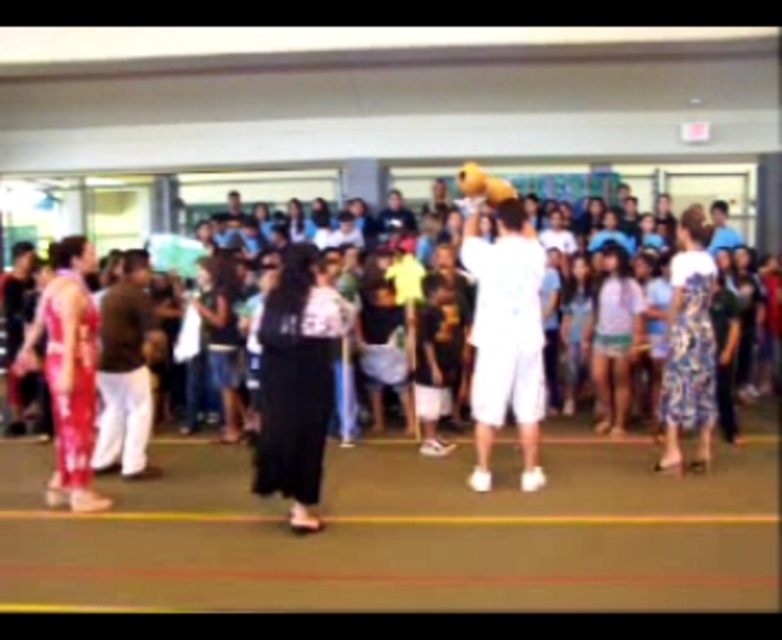
You are a photographer trying to capture a photo of both the white cotton shorts at center and the shiny red fabric pants at left. Since you want both subjects to appear equally prominent in the photo, which one should you zoom in more on?

The white cotton shorts at center is much taller than the shiny red fabric pants at left, so to make them appear equally prominent in the photo, you should zoom in more on the shiny red fabric pants at left to compensate for its smaller size.

From the picture: You are standing at the entrance of the room and want to locate the black fabric dress at center. Based on the coordinates provided, in which direction should you look to find it?

The black fabric dress at center is located at coordinates point 0.600 on the x axis and 0.379 on the y axis. Since you are at the entrance, you should look towards the center of the room slightly to the right and forward to find it.

You are a photographer positioned at the back of the room. You want to take a photo that includes both the black fabric dress at center and the white cotton shorts at center. Which one should you adjust your camera angle to focus on first to ensure both are in frame?

Since the black fabric dress at center is to the left of white cotton shorts at center, you should focus on the black fabric dress at center first to ensure both are captured in the frame.